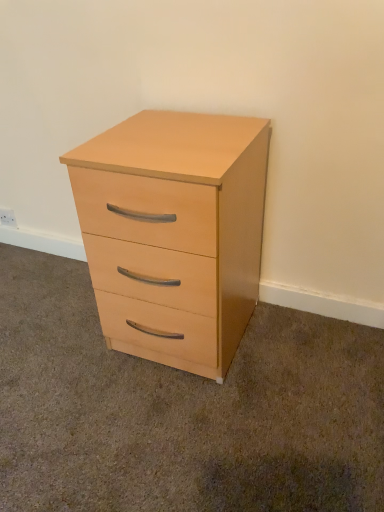
The width and height of the screenshot is (384, 512). I want to click on vacant space to the right of light wood/finish chest of drawers at center, so click(301, 353).